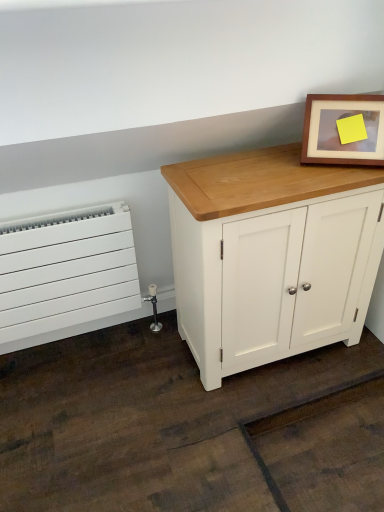
Identify the location of vacant space situated above white matte radiator at left (from a real-world perspective). (48, 216).